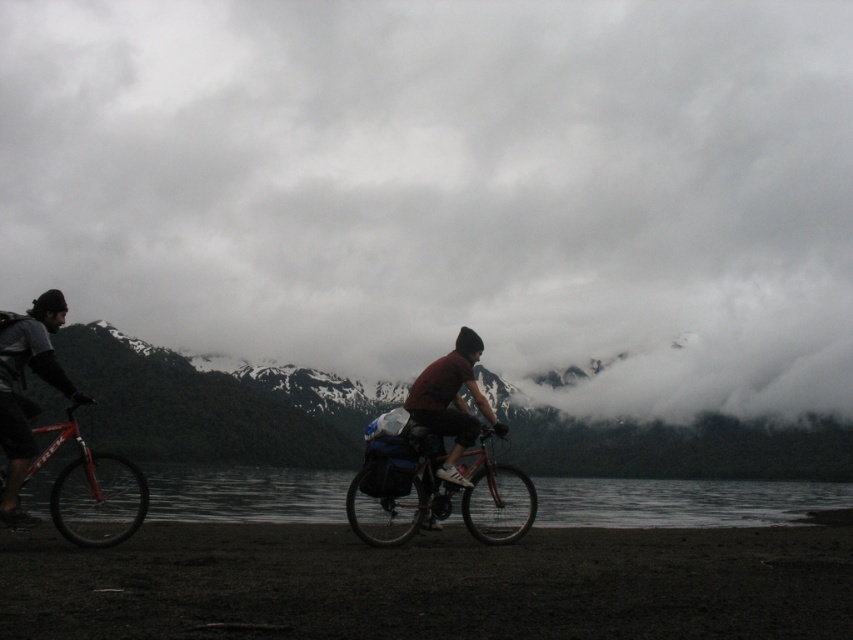
You are a photographer planning to take a reflection shot of the transparent water at lower center. However, you need to avoid the matte black jacket at left from casting a shadow over it. Based on their positions, is the jacket likely blocking the water from direct sunlight?

The transparent water at lower center is below matte black jacket at left, so the jacket is positioned above the water. Since the jacket is above, it could cast a shadow on the water if sunlight is coming from the opposite direction. However, the scene mentions overcast skies, which diffuse sunlight, reducing direct shadows. Thus, the jacket might not cast a strong shadow, making it possible to capture the reflection without obstruction.

You are planning to take a walk along the dark sand shoreline at lower center and the transparent water at lower center. Which area has a larger surface area in the image?

The transparent water at lower center has a larger surface area than the dark sand shoreline at lower center because the dark sand shoreline at lower center is smaller than transparent water at lower center.

You are a photographer trying to capture the reflection of the matte black jacket at left in the transparent water at lower center. Based on the scene, will the reflection be clear and visible?

The transparent water at lower center has a lesser height compared to matte black jacket at left, so the reflection of the matte black jacket at left may not be fully visible in the water since the water is shallower and might not provide a complete mirror surface.